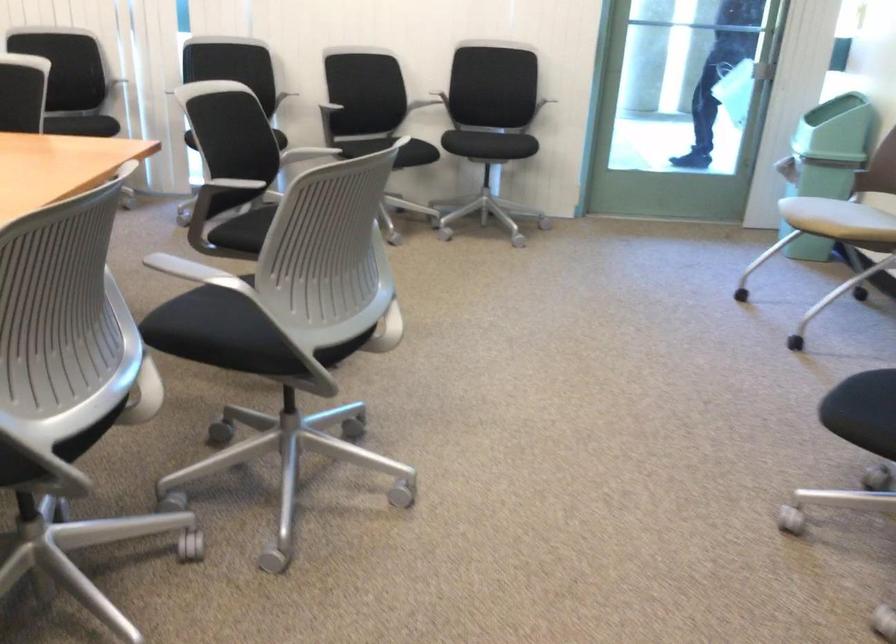
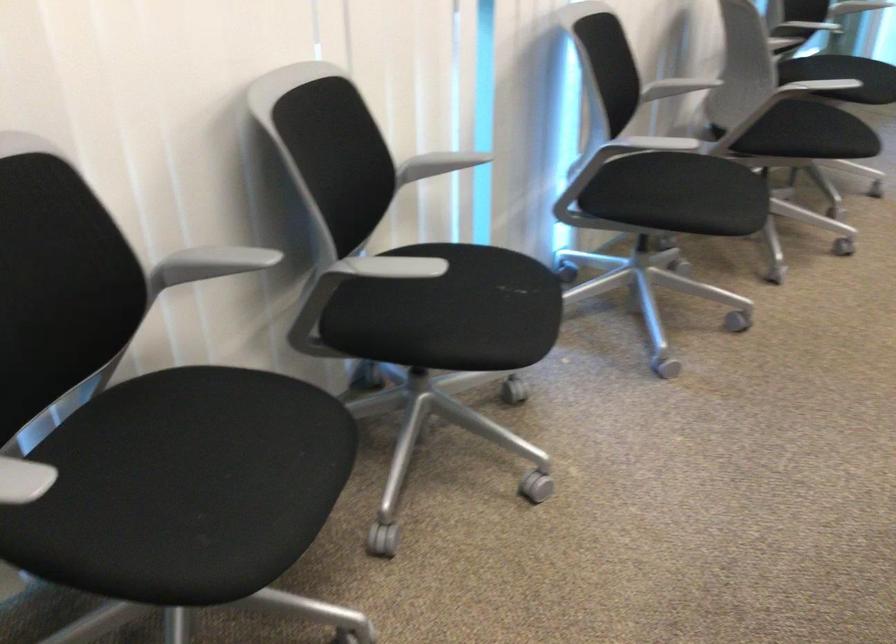
Locate, in the second image, the point that corresponds to [126,67] in the first image.

(438, 164)